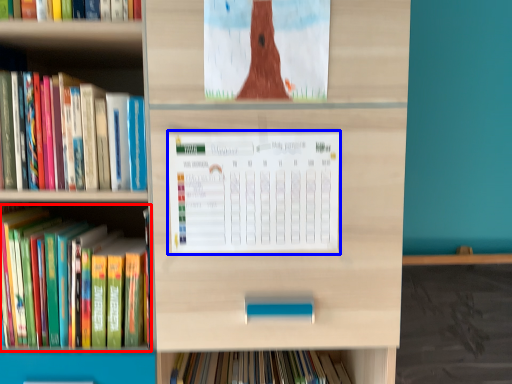
Question: Among these objects, which one is farthest to the camera, book (highlighted by a red box) or paperback book (highlighted by a blue box)?

Choices:
 (A) book
 (B) paperback book

Answer: (A)